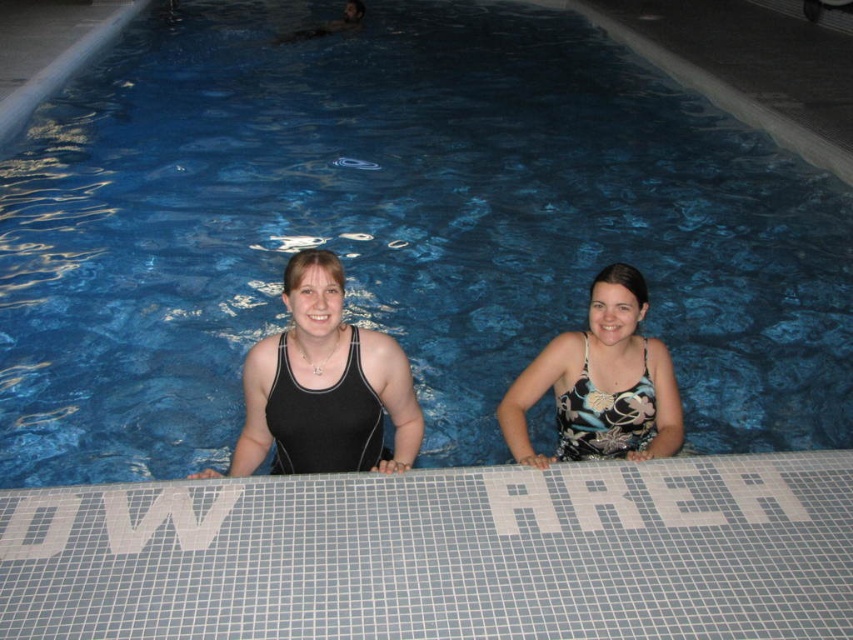
Question: Is black matte swimsuit at center bigger than floral print tank top at center?

Choices:
 (A) no
 (B) yes

Answer: (B)

Question: Is black matte swimsuit at center below floral print tank top at center?

Choices:
 (A) yes
 (B) no

Answer: (B)

Question: Which point is farther to the camera?

Choices:
 (A) (535, 365)
 (B) (337, 276)

Answer: (A)

Question: Does black matte swimsuit at center have a larger size compared to floral print tank top at center?

Choices:
 (A) yes
 (B) no

Answer: (A)

Question: Which object appears farthest from the camera in this image?

Choices:
 (A) floral print tank top at center
 (B) black matte swimsuit at center

Answer: (A)